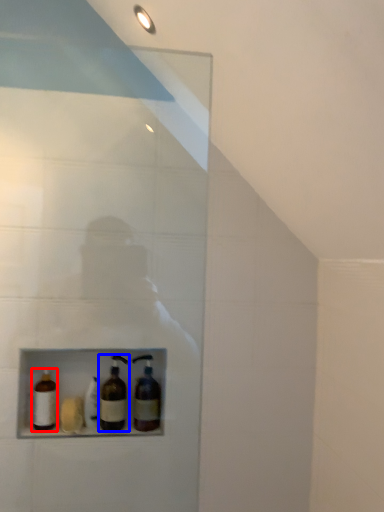
Question: Among these objects, which one is farthest to the camera, bottle (highlighted by a red box) or bottle (highlighted by a blue box)?

Choices:
 (A) bottle
 (B) bottle

Answer: (B)